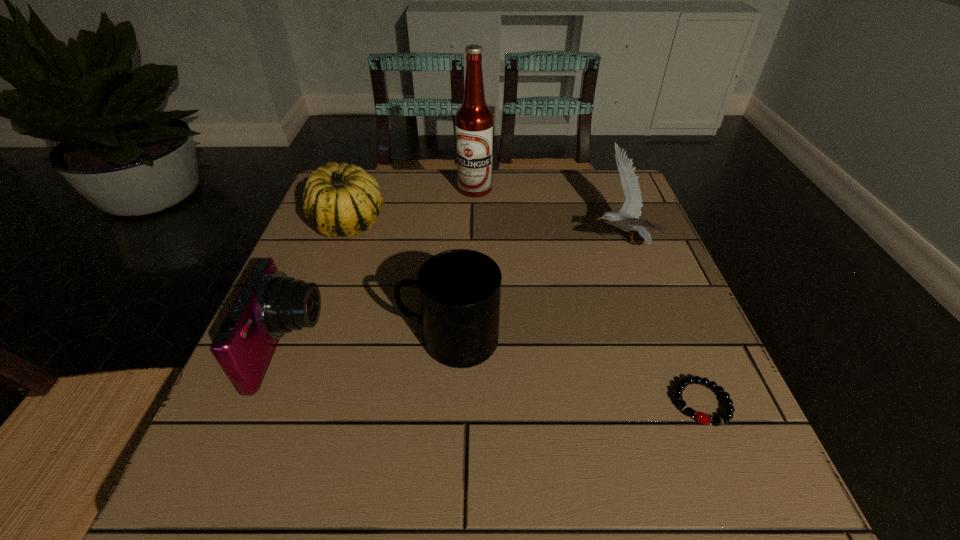
Find the location of `vacant space located at the tip of the beak of the gull`. vacant space located at the tip of the beak of the gull is located at coordinates click(483, 243).

The width and height of the screenshot is (960, 540). I want to click on free region located on the side of the mug with the handle, so click(348, 341).

Image resolution: width=960 pixels, height=540 pixels. I want to click on blank space located 0.210m on the side of the mug with the handle, so click(x=287, y=341).

Locate an element on the screen. vacant space located on the side of the mug with the handle is located at coordinates (370, 341).

Identify the location of free space located 0.310m on the front of the gourd. The image size is (960, 540). (299, 358).

Identify the location of vacant area situated on the front-facing side of the camera. This screenshot has width=960, height=540. [434, 348].

Find the location of a particular element. vacant space located on the left of the shortest object is located at coordinates (431, 403).

Locate an element on the screen. The width and height of the screenshot is (960, 540). alcohol located in the far edge section of the desktop is located at coordinates (474, 121).

This screenshot has height=540, width=960. I want to click on gull that is at the far edge, so (x=627, y=219).

Find the location of a particular element. gourd at the far edge is located at coordinates (339, 200).